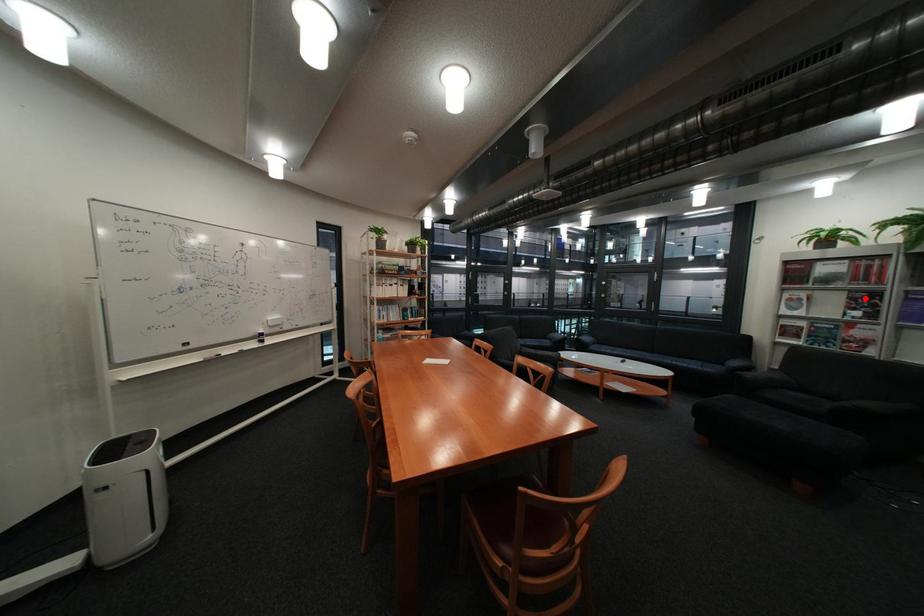
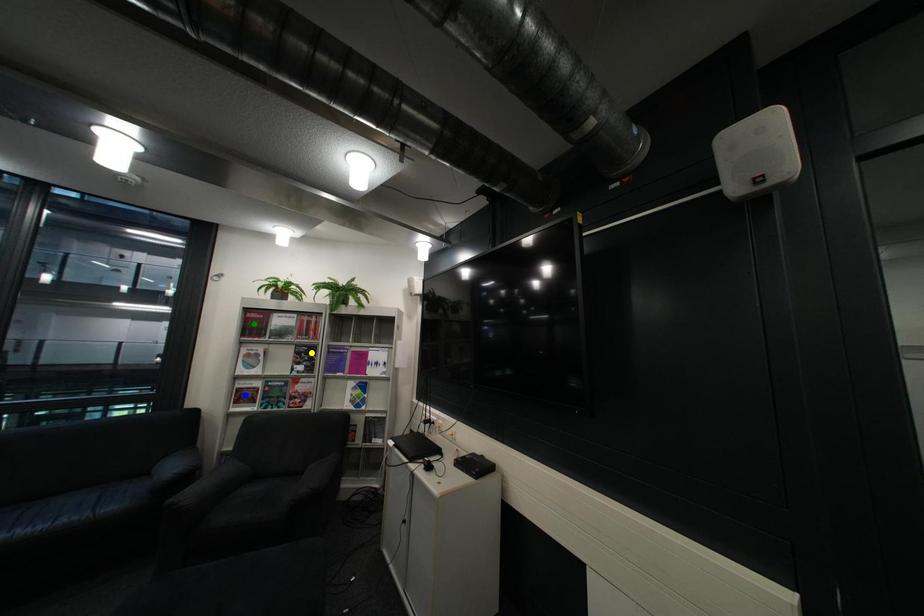
Question: I am providing you with two images of the same scene from different viewpoints. A red point is marked on the first image. You are given multiple points on the second image. Which mark in image 2 goes with the point in image 1?

Choices:
 (A) blue point
 (B) green point
 (C) yellow point

Answer: (C)